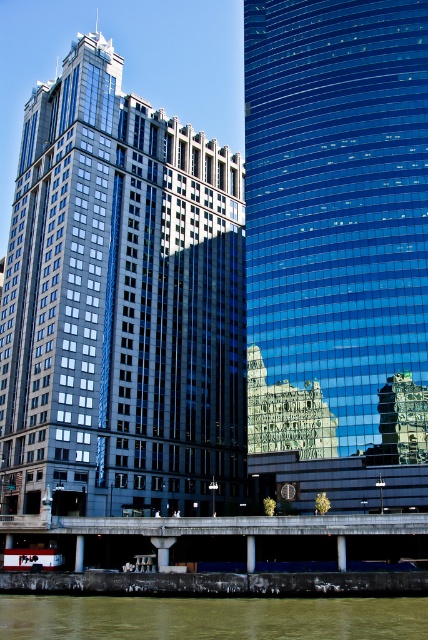
You are standing in the cityscape scene and want to take a photo of both the point at coordinates (425, 72) and the point at coordinates (275, 612). Which point should you focus on first to ensure both are in sharp focus?

You should focus on the point at coordinates (425, 72) first because it is closer to the camera than the point at coordinates (275, 612). This ensures both points will be in focus as the depth of field will cover the distance between them.

You are a tourist standing in the city park and want to take a photo of both the shiny glass skyscraper at center and the blue glass skyscraper at center. Which skyscraper should you stand closer to in order to include both in your photo without cropping either?

You should stand closer to the blue glass skyscraper at center because it is shorter than the shiny glass skyscraper at center, allowing you to frame both in the photo by positioning yourself nearer to the shorter one.